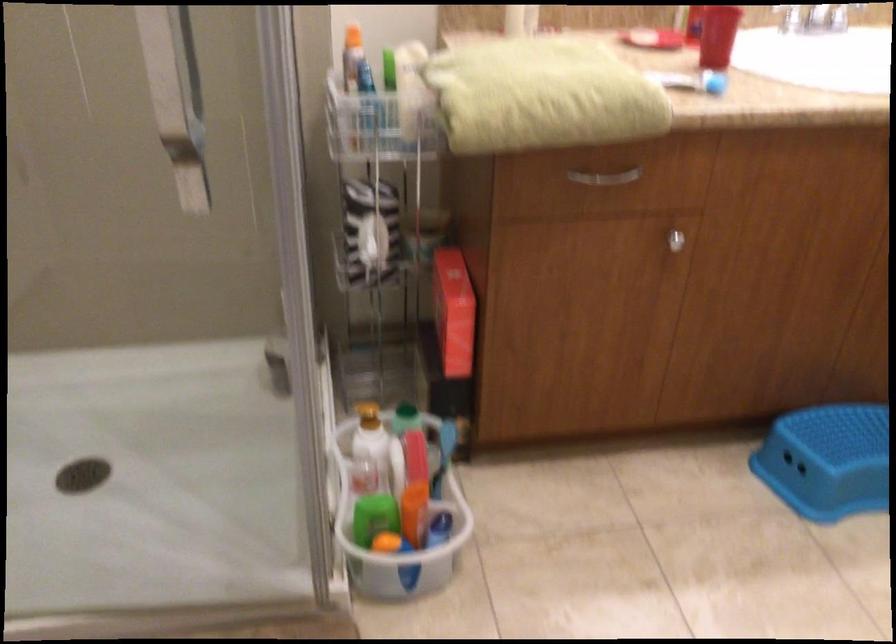
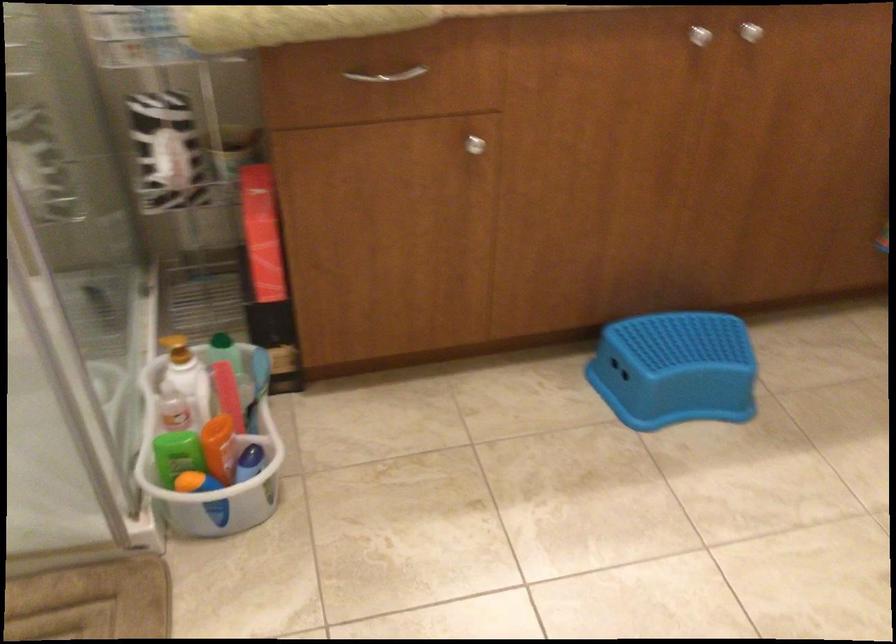
In the second image, find the point that corresponds to (375,518) in the first image.

(177, 453)